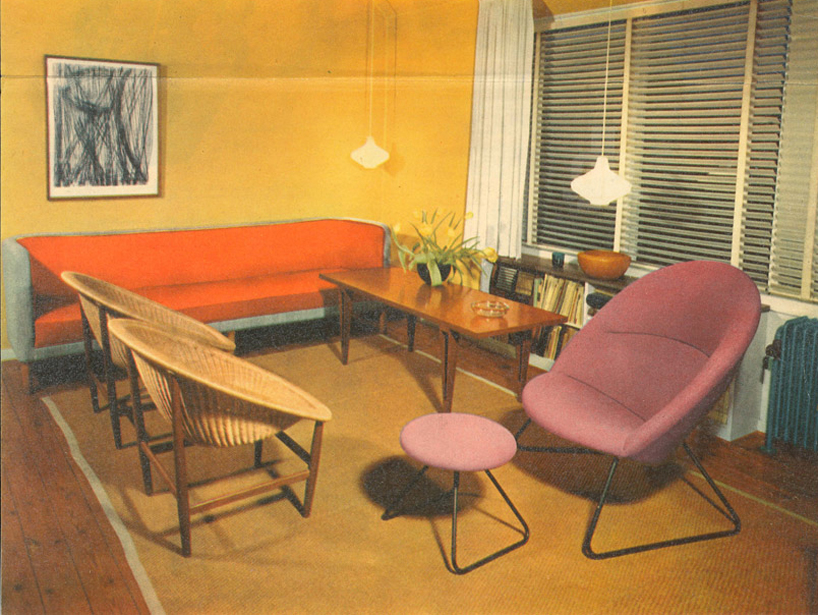
Point to visible where you sit in the image. Your answer should be formatted as a list of tuples, i.e. [(x1, y1), (x2, y2), ...], where each tuple contains the x and y coordinates of a point satisfying the conditions above.

[(563, 390), (168, 319), (231, 376)]